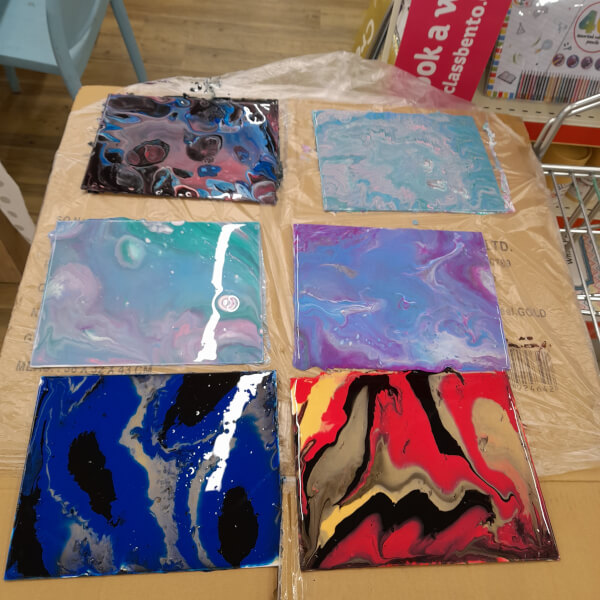
Identify the location of shelfing. (520, 112).